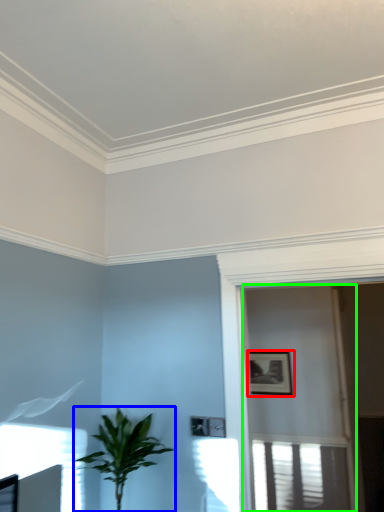
Question: Based on their relative distances, which object is farther from picture frame (highlighted by a red box)? Choose from houseplant (highlighted by a blue box) and screen door (highlighted by a green box).

Choices:
 (A) houseplant
 (B) screen door

Answer: (A)